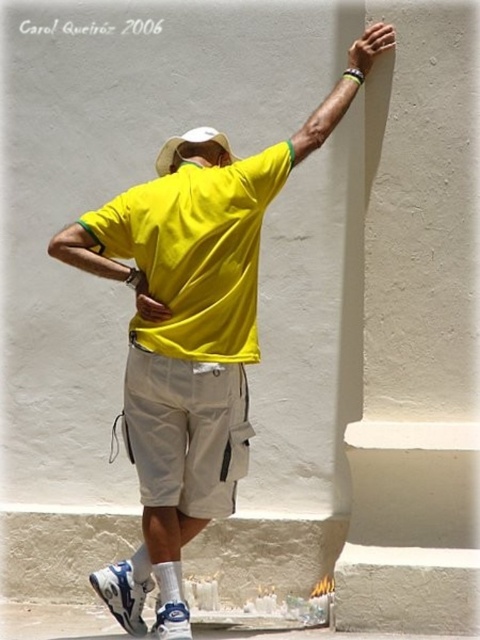
Question: Can you confirm if matte yellow arm at upper right is positioned above matte yellow shirt at back?

Choices:
 (A) yes
 (B) no

Answer: (A)

Question: Considering the relative positions of matte yellow arm at upper right and white matte baseball hat at back in the image provided, where is matte yellow arm at upper right located with respect to white matte baseball hat at back?

Choices:
 (A) above
 (B) below

Answer: (A)

Question: Considering the real-world distances, which object is closest to the khaki cotton shorts at center?

Choices:
 (A) white matte baseball hat at back
 (B) yellow matte shirt at center

Answer: (B)

Question: Which object is positioned farthest from the white matte hand at upper right?

Choices:
 (A) khaki cotton shorts at center
 (B) matte yellow shirt at back
 (C) yellow matte shirt at back

Answer: (A)

Question: Can you confirm if yellow matte shirt at back is positioned above white matte baseball hat at back?

Choices:
 (A) yes
 (B) no

Answer: (B)

Question: Which of these objects is positioned farthest from the white matte baseball hat at back?

Choices:
 (A) white matte hand at upper right
 (B) yellow matte shirt at center
 (C) matte yellow arm at upper right
 (D) matte yellow shirt at back

Answer: (B)